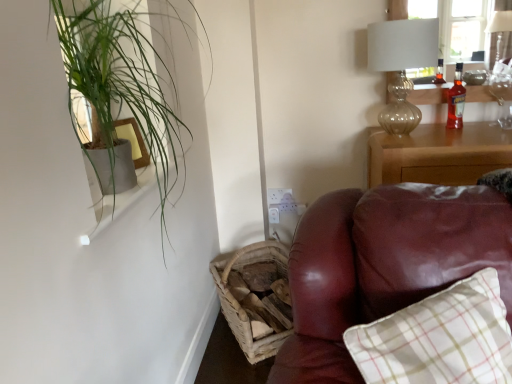
Question: Would you say matte wood picture frame at upper left is inside or outside woven wood basket at lower left?

Choices:
 (A) outside
 (B) inside

Answer: (A)

Question: Looking at their shapes, would you say matte wood picture frame at upper left is wider or thinner than woven wood basket at lower left?

Choices:
 (A) thin
 (B) wide

Answer: (A)

Question: Which is farther from the translucent glass table lamp at upper right?

Choices:
 (A) white glossy window sill at upper left
 (B) green leafy plant at upper left
 (C) matte wood picture frame at upper left
 (D) wooden nightstand at right
 (E) woven wood basket at lower left

Answer: (C)

Question: Which is farther from the white glossy window sill at upper left?

Choices:
 (A) woven wood basket at lower left
 (B) green leafy plant at upper left
 (C) translucent glass table lamp at upper right
 (D) translucent amber glass bottle at upper right
 (E) matte wood picture frame at upper left

Answer: (D)